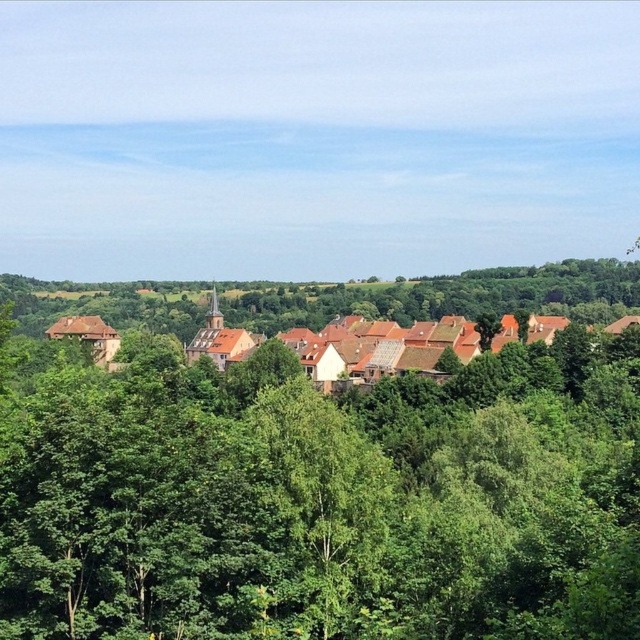
Between green leafy tree at center and brown clay houses at center, which one is positioned higher?

brown clay houses at center is above.

Between green leafy tree at center and brown clay houses at center, which one has more height?

Standing taller between the two is brown clay houses at center.

At what (x,y) coordinates should I click in order to perform the action: click on green leafy tree at center. Please return your answer as a coordinate pair (x, y). Looking at the image, I should click on tap(320, 486).